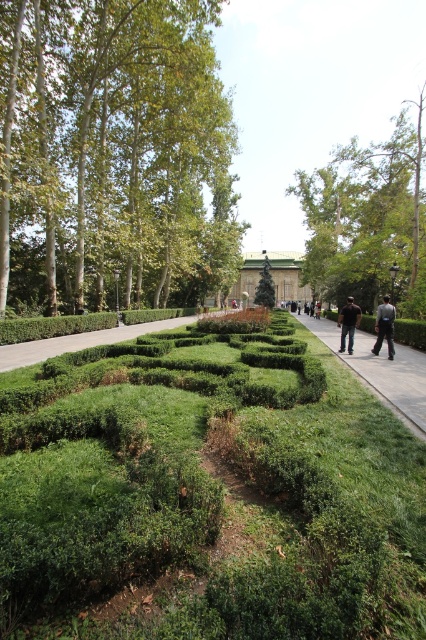
You are a gardener who needs to walk from one end of the garden to the other. You see the green leafy hedge at center and the gray concrete sidewalk at center. Which path should you choose to avoid stepping on the plants?

The gray concrete sidewalk at center is the correct path to choose since it is larger than the green leafy hedge at center, making it suitable for walking without damaging the plants.

You are standing at the point labeled point (385, 301) in the garden. There is a tree on the left side of the pathway and another tree on the right side. Which tree is closer to your current position?

The trees on both sides of the pathway are 15.09 meters apart, so the distance between them is the same. Therefore, both trees are equidistant from your current position at point (385, 301).

Looking at this image, you are a gardener standing on the gray concrete sidewalk at center. You want to trim the green leafy hedge at center. Which direction should you face to reach the hedge?

The green leafy hedge at center is located below the gray concrete sidewalk at center, so you should face downward or look downward to reach the hedge.